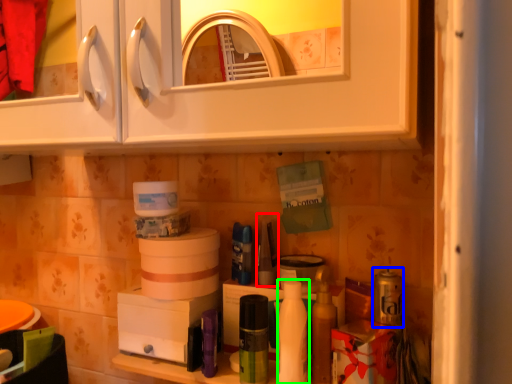
Question: Which object is positioned closest to toiletry (highlighted by a red box)? Select from toiletry (highlighted by a blue box) and cleaning product (highlighted by a green box).

Choices:
 (A) toiletry
 (B) cleaning product

Answer: (B)